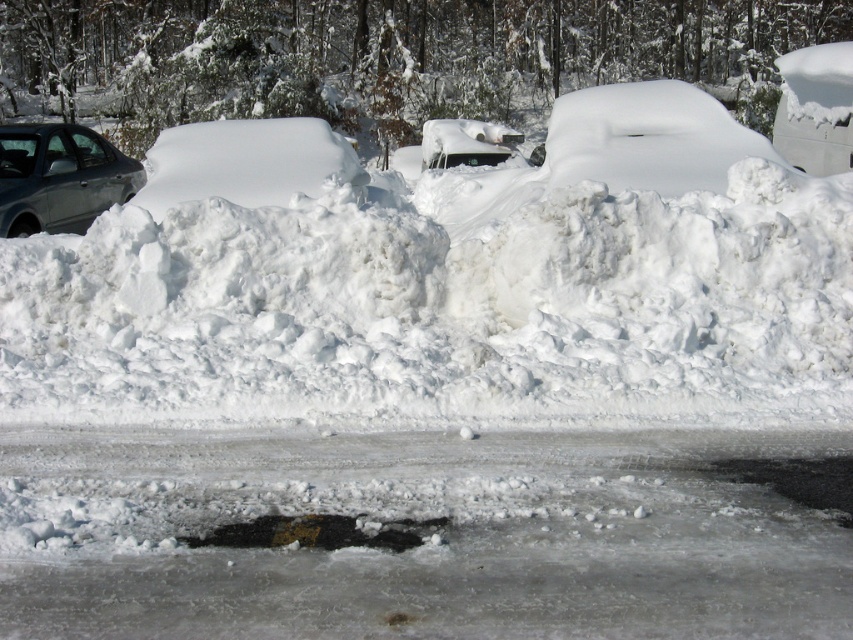
Question: Can you confirm if matte gray sedan at left is positioned to the right of white glossy car at center?

Choices:
 (A) yes
 (B) no

Answer: (B)

Question: Observing the image, what is the correct spatial positioning of matte gray sedan at left in reference to white glossy car at center?

Choices:
 (A) above
 (B) below

Answer: (B)

Question: Which object is closer to the camera taking this photo?

Choices:
 (A) white glossy car at center
 (B) matte gray sedan at left

Answer: (B)

Question: Is matte gray sedan at left below white glossy car at center?

Choices:
 (A) yes
 (B) no

Answer: (A)